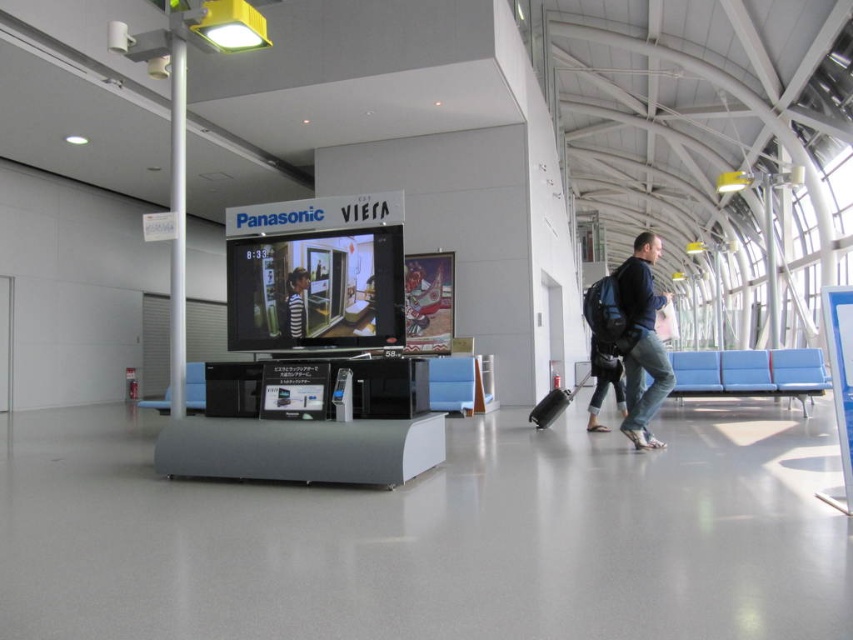
You are standing in the airport terminal and see both the dark blue jeans at right and the striped fabric shirt at center. Which item is positioned more to the east side of the terminal?

The dark blue jeans at right is positioned to the right of the striped fabric shirt at center, so it is more to the east side of the terminal if the striped fabric shirt at center is in the central area.

You are standing in the airport terminal and see the Panasonic Viera television mounted on a stand. Where exactly is the dark blue jeans at right located relative to the TV? Please provide coordinates in the format of a point with two decimal places.

Answer: The dark blue jeans at right is located at point (641, 340) relative to the Panasonic Viera television mounted on a stand.

You are a traveler who just arrived at the airport terminal. You see a Panasonic Viera TV at the center with a striped fabric shirt at center and a black matte suitcase at center displayed below it. Which object is smaller in size?

The striped fabric shirt at center is smaller than the black matte suitcase at center.